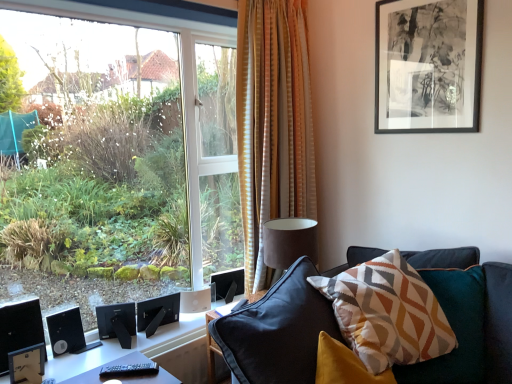
Find the location of a particular element. This screenshot has width=512, height=384. black plastic table at lower left is located at coordinates (148, 352).

This screenshot has height=384, width=512. What do you see at coordinates (118, 155) in the screenshot?
I see `transparent glass window at left` at bounding box center [118, 155].

This screenshot has height=384, width=512. Describe the element at coordinates (66, 332) in the screenshot. I see `black matte speaker at lower left, which is the 1th speaker in left-to-right order` at that location.

Measure the distance between striped fabric curtain at center and camera.

2.20 meters.

What do you see at coordinates (157, 313) in the screenshot? This screenshot has height=384, width=512. I see `black matte speaker at lower left, acting as the 1th speaker starting from the right` at bounding box center [157, 313].

Where is `geometric-patterned fabric pillow at center-right`? The height and width of the screenshot is (384, 512). geometric-patterned fabric pillow at center-right is located at coordinates (387, 313).

Is black matte speaker at lower left, arranged as the 3th speaker when viewed from the right, positioned with its back to black plastic table at lower left?

No, black matte speaker at lower left, arranged as the 3th speaker when viewed from the right,'s orientation is not away from black plastic table at lower left.

From the image's perspective, is black matte speaker at lower left, arranged as the 3th speaker when viewed from the right, above black plastic table at lower left?

Yes, from the image's perspective, black matte speaker at lower left, arranged as the 3th speaker when viewed from the right, is above black plastic table at lower left.

Which of these two, black matte speaker at lower left, which is the 1th speaker in left-to-right order, or black plastic table at lower left, is bigger?

black plastic table at lower left.

Is black matte speaker at lower left, acting as the second speaker starting from the left, bigger than black plastic table at lower left?

Incorrect, black matte speaker at lower left, acting as the second speaker starting from the left, is not larger than black plastic table at lower left.

Is black matte speaker at lower left, acting as the second speaker starting from the left, not close to black plastic table at lower left?

They are positioned close to each other.

Is black matte speaker at lower left, acting as the second speaker starting from the left, shorter than black plastic table at lower left?

No.

From a real-world perspective, relative to black plastic table at lower left, is black matte speaker at lower left, the second speaker viewed from the right, vertically above or below?

Clearly, from a real-world perspective, black matte speaker at lower left, the second speaker viewed from the right, is above black plastic table at lower left.

Is point (142, 329) farther from viewer compared to point (80, 367)?

Yes.

Are black matte speaker at lower left, acting as the 1th speaker starting from the right, and black plastic table at lower left located far from each other?

black matte speaker at lower left, acting as the 1th speaker starting from the right, is actually quite close to black plastic table at lower left.

Can you confirm if black matte speaker at lower left, acting as the 1th speaker starting from the right, is taller than black plastic table at lower left?

Yes.

Is black matte speaker at lower left, which is the 3th speaker from left to right, facing towards black plastic table at lower left?

No.

This screenshot has width=512, height=384. I want to click on speaker that is the 3rd object directly below the black glossy monitor at lower left (from a real-world perspective), so click(x=157, y=313).

Who is shorter, black glossy monitor at lower left or black matte speaker at lower left, acting as the 1th speaker starting from the right?

With less height is black matte speaker at lower left, acting as the 1th speaker starting from the right.

Which is more distant, [37,308] or [163,304]?

The point [163,304] is more distant.

Is black glossy monitor at lower left oriented away from black matte speaker at lower left, which is the 3th speaker from left to right?

No.

Between striped fabric curtain at center and black plastic table at lower left, which one is positioned behind?

striped fabric curtain at center is behind.

From a real-world perspective, relative to black plastic table at lower left, is striped fabric curtain at center vertically above or below?

striped fabric curtain at center is situated higher than black plastic table at lower left in the real world.

Can you confirm if striped fabric curtain at center is positioned to the left of black plastic table at lower left?

No, striped fabric curtain at center is not to the left of black plastic table at lower left.

Considering the sizes of striped fabric curtain at center and black plastic table at lower left in the image, is striped fabric curtain at center bigger or smaller than black plastic table at lower left?

Considering their sizes, striped fabric curtain at center takes up more space than black plastic table at lower left.

Considering the positions of objects black matte picture frame at upper right and black glossy monitor at lower left in the image provided, who is more to the right, black matte picture frame at upper right or black glossy monitor at lower left?

Positioned to the right is black matte picture frame at upper right.

Is black matte picture frame at upper right completely or partially outside of black glossy monitor at lower left?

Yes, black matte picture frame at upper right is outside of black glossy monitor at lower left.

Which object is closer to the camera taking this photo, black matte picture frame at upper right or black glossy monitor at lower left?

black matte picture frame at upper right is in front.

Is black matte picture frame at upper right smaller than black glossy monitor at lower left?

Actually, black matte picture frame at upper right might be larger than black glossy monitor at lower left.

Are striped fabric curtain at center and transparent glass window at left beside each other?

No.

Considering the positions of points (238, 30) and (195, 106), is point (238, 30) farther from camera compared to point (195, 106)?

No.

Does striped fabric curtain at center turn towards transparent glass window at left?

No, striped fabric curtain at center is not oriented towards transparent glass window at left.

From the image's perspective, between striped fabric curtain at center and transparent glass window at left, which one is located above?

striped fabric curtain at center appears higher in the image.

Image resolution: width=512 pixels, height=384 pixels. Find the location of `the 1st speaker above the black plastic table at lower left (from the image's perspective)`. the 1st speaker above the black plastic table at lower left (from the image's perspective) is located at coordinates (66, 332).

Where is `table in front of the black matte speaker at lower left, the second speaker viewed from the right`? This screenshot has height=384, width=512. table in front of the black matte speaker at lower left, the second speaker viewed from the right is located at coordinates pos(148,352).

Which object lies further to the anchor point black matte speaker at lower left, the second speaker viewed from the right, geometric-patterned fabric pillow at center-right or black plastic table at lower left?

Based on the image, geometric-patterned fabric pillow at center-right appears to be further to black matte speaker at lower left, the second speaker viewed from the right.

In the scene shown: Based on their spatial positions, is black matte speaker at lower left, arranged as the 3th speaker when viewed from the right, or black plastic table at lower left further from transparent glass window at left?

Among the two, black plastic table at lower left is located further to transparent glass window at left.

Looking at the image, which one is located further to black glossy monitor at lower left, black matte speaker at lower left, arranged as the 3th speaker when viewed from the right, or black plastic table at lower left?

black plastic table at lower left.

Looking at the image, which one is located further to black matte picture frame at upper right, black plastic table at lower left or black matte speaker at lower left, arranged as the 3th speaker when viewed from the right?

black matte speaker at lower left, arranged as the 3th speaker when viewed from the right, is positioned further to the anchor black matte picture frame at upper right.

Looking at the image, which one is located further to transparent glass window at left, black matte picture frame at upper right or black matte speaker at lower left, which is the 1th speaker in left-to-right order?

Among the two, black matte picture frame at upper right is located further to transparent glass window at left.

Which object lies further to the anchor point striped fabric curtain at center, geometric-patterned fabric pillow at center-right or black matte speaker at lower left, which is the 3th speaker from left to right?

The object further to striped fabric curtain at center is black matte speaker at lower left, which is the 3th speaker from left to right.

Based on their spatial positions, is striped fabric curtain at center or black matte picture frame at upper right further from black plastic table at lower left?

black matte picture frame at upper right lies further to black plastic table at lower left than the other object.

When comparing their distances from striped fabric curtain at center, does black glossy monitor at lower left or transparent glass window at left seem closer?

Among the two, black glossy monitor at lower left is located nearer to striped fabric curtain at center.

The width and height of the screenshot is (512, 384). I want to click on table between black glossy monitor at lower left and geometric-patterned fabric pillow at center-right, so click(x=148, y=352).

Where is `pillow between black matte speaker at lower left, the second speaker viewed from the right, and black matte picture frame at upper right from left to right`? pillow between black matte speaker at lower left, the second speaker viewed from the right, and black matte picture frame at upper right from left to right is located at coordinates (387, 313).

Locate an element on the screen. This screenshot has width=512, height=384. speaker between black glossy monitor at lower left and black matte speaker at lower left, acting as the second speaker starting from the left, from left to right is located at coordinates (66, 332).

Locate an element on the screen. This screenshot has height=384, width=512. speaker between striped fabric curtain at center and black matte speaker at lower left, acting as the second speaker starting from the left, from top to bottom is located at coordinates (157, 313).